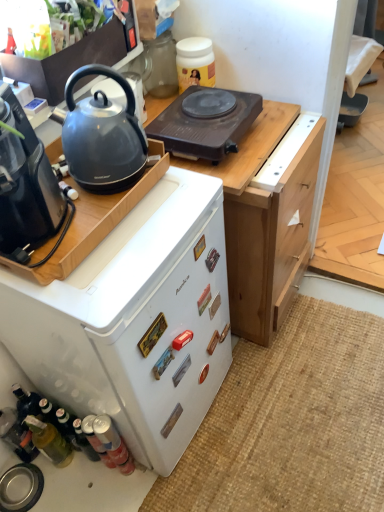
Find the location of a particular element. Image resolution: width=384 pixels, height=512 pixels. vacant area to the right of translucent glass bottle at lower left is located at coordinates (107, 480).